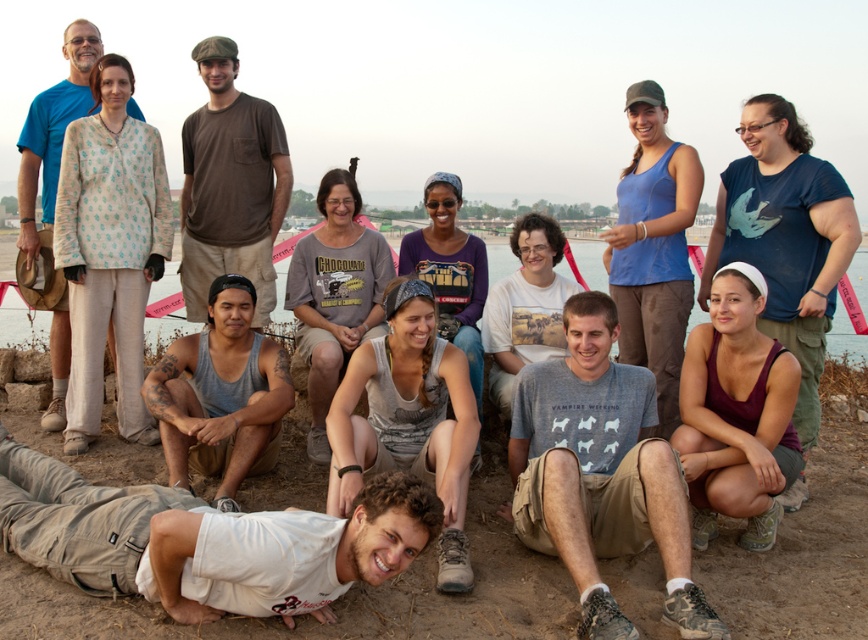
Question: Observing the image, what is the correct spatial positioning of brown sandy ground at lower center in reference to gray cotton t-shirt at lower center?

Choices:
 (A) left
 (B) right

Answer: (A)

Question: Which point is farther from the camera taking this photo?

Choices:
 (A) (651, 394)
 (B) (74, 45)
 (C) (262, 140)

Answer: (B)

Question: Considering the relative positions of gray cotton t-shirt at lower center and blue cotton shirt at upper left in the image provided, where is gray cotton t-shirt at lower center located with respect to blue cotton shirt at upper left?

Choices:
 (A) left
 (B) right

Answer: (B)

Question: Which point is closer to the camera taking this photo?

Choices:
 (A) (570, 337)
 (B) (27, 227)
 (C) (222, 42)
 (D) (803, 577)

Answer: (D)

Question: Observing the image, what is the correct spatial positioning of brown sandy ground at lower center in reference to gray matte tank top at center?

Choices:
 (A) right
 (B) left

Answer: (A)

Question: Among these objects, which one is farthest from the camera?

Choices:
 (A) white cotton shirt at lower center
 (B) gray cotton t-shirt at lower center
 (C) gray matte tank top at center
 (D) blue cotton shirt at upper left

Answer: (D)